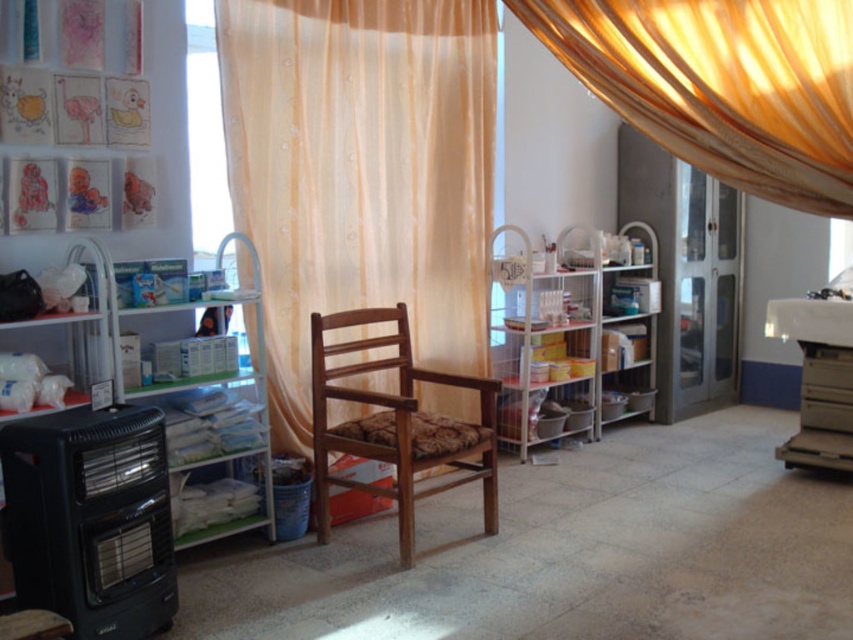
Question: Which point is farther from the camera taking this photo?

Choices:
 (A) (479, 378)
 (B) (541, 28)
 (C) (814, 445)
 (D) (306, 296)

Answer: (C)

Question: Is wooden chair at center smaller than transparent plastic window at upper left?

Choices:
 (A) yes
 (B) no

Answer: (B)

Question: Which object is positioned farthest from the translucent yellowish fabric at upper center?

Choices:
 (A) wooden chair at center
 (B) transparent plastic window at upper left
 (C) translucent yellowish curtain at center

Answer: (B)

Question: Considering the real-world distances, which object is farthest from the transparent plastic window at upper left?

Choices:
 (A) metallic gray printer at right
 (B) translucent yellowish curtain at center
 (C) translucent yellowish fabric at upper center

Answer: (A)

Question: Observing the image, what is the correct spatial positioning of translucent yellowish curtain at center in reference to metallic gray printer at right?

Choices:
 (A) above
 (B) below

Answer: (A)

Question: Is translucent yellowish curtain at center positioned behind wooden chair at center?

Choices:
 (A) yes
 (B) no

Answer: (A)